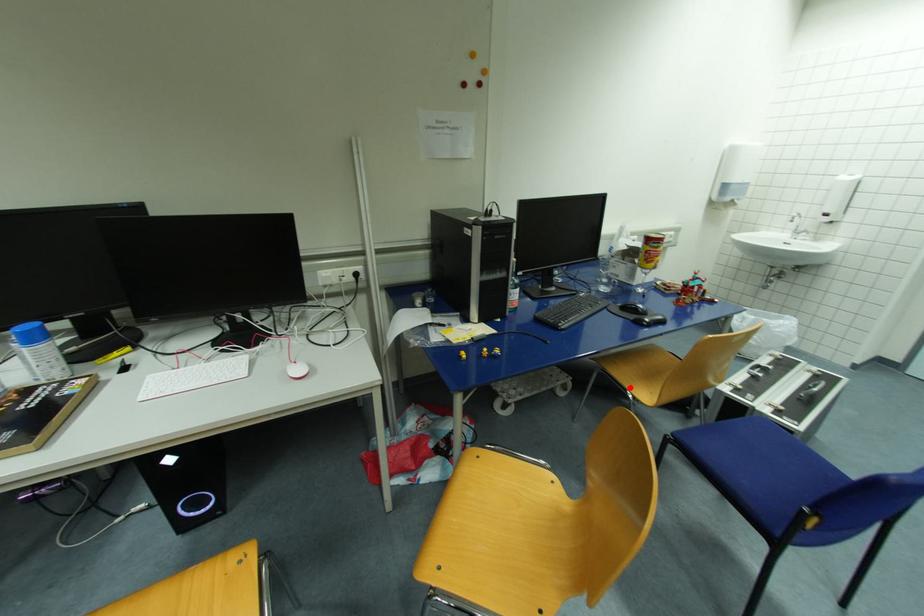
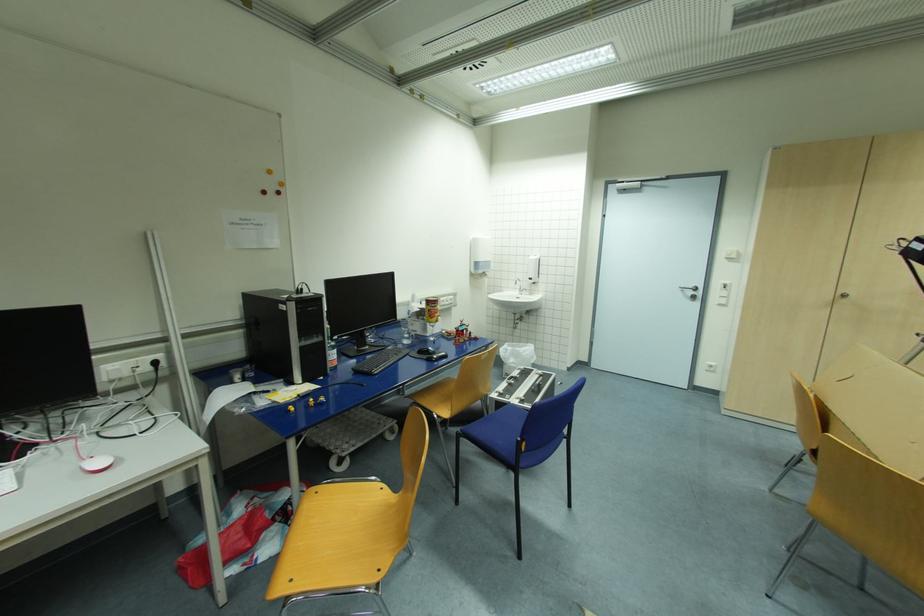
Locate, in the second image, the point that corresponds to the highlighted location in the first image.

(434, 410)